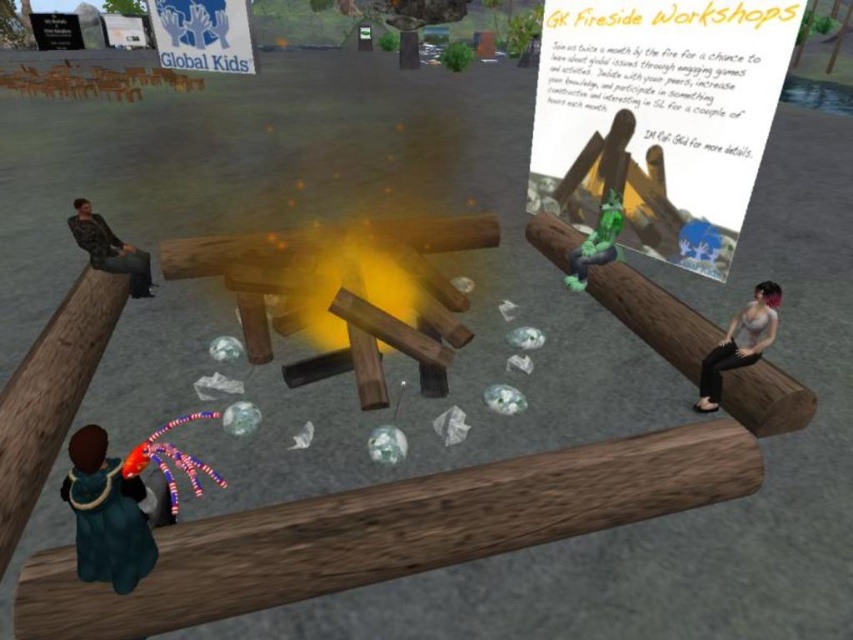
You are attending the GK Fireside Workshops event and notice two green items near the campfire. The green woolen coat at lower left and the green rubber figure at center. Which of these items is narrower in width?

The green woolen coat at lower left is thinner than the green rubber figure at center, so the green woolen coat at lower left is narrower in width.

You are attending the GK Fireside Workshops event and want to take a photo of the point at coordinates (370,522). If your camera has a maximum focus range of 2.5 meters, will it be able to focus on that point?

The point at coordinates (370,522) is 2.46 meters away from the viewer. Since this distance is within the camera maximum focus range of 2.5 meters, the camera can focus on the point.

You are attending the GK Fireside Workshops event and notice the brown wood beam at lower center and the green woolen coat at lower left. Which object is taller in this virtual scene?

The brown wood beam at lower center is much taller than the green woolen coat at lower left.